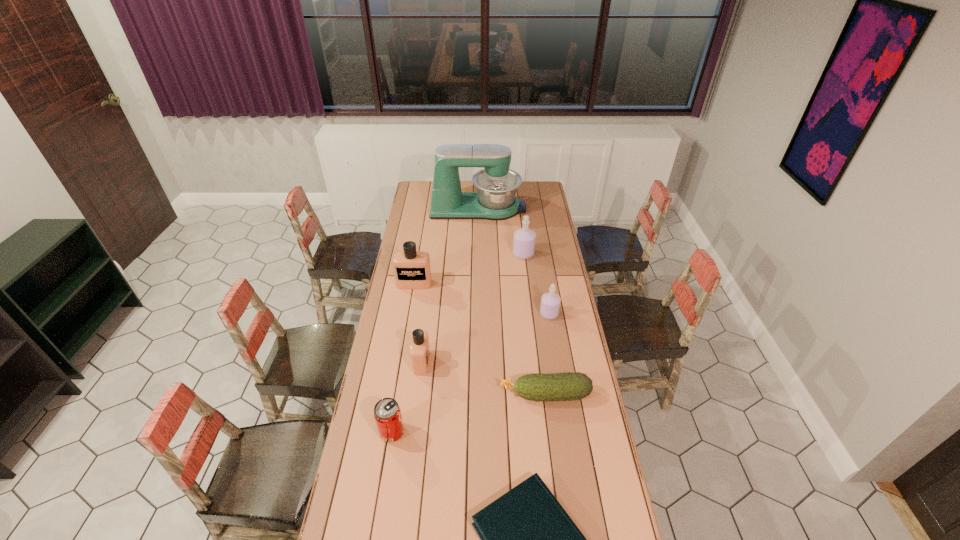
Image resolution: width=960 pixels, height=540 pixels. I want to click on pop soda, so click(x=387, y=413).

Find the location of a particular element. Image resolution: width=960 pixels, height=540 pixels. the sixth tallest object is located at coordinates (387, 413).

I want to click on the second shortest object, so click(x=568, y=386).

Where is `cucumber`? cucumber is located at coordinates (568, 386).

Where is `vacant space situated on the front-facing side of the mixer`? The image size is (960, 540). vacant space situated on the front-facing side of the mixer is located at coordinates (540, 208).

Find the location of a particular element. The height and width of the screenshot is (540, 960). vacant region located on the left of the seventh nearest object is located at coordinates (445, 254).

The image size is (960, 540). Identify the location of vacant space positioned 0.190m on the front label of the third nearest perfume. (408, 318).

Locate an element on the screen. vacant space located 0.240m on the front of the smaller purple perfume is located at coordinates (557, 363).

Locate an element on the screen. free space located 0.250m on the front label of the nearest perfume is located at coordinates (491, 362).

Where is `free space located on the right of the pop soda`? The width and height of the screenshot is (960, 540). free space located on the right of the pop soda is located at coordinates (507, 432).